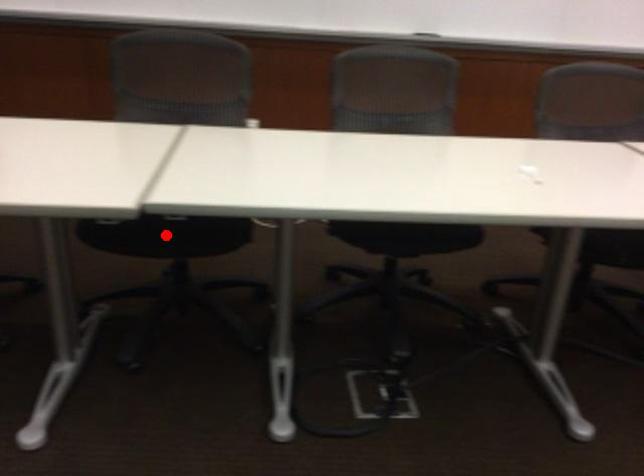
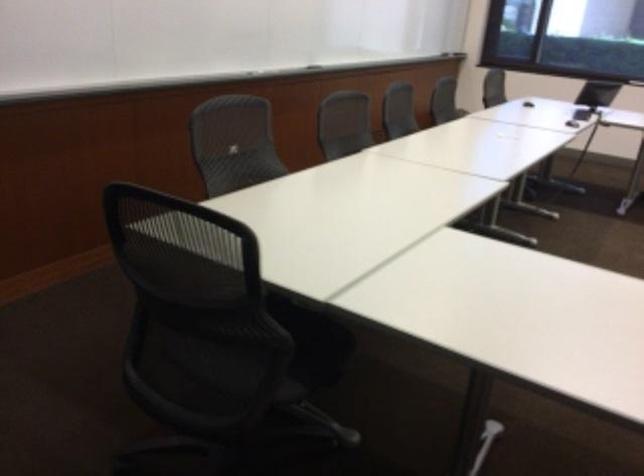
Question: I am providing you with two images of the same scene from different viewpoints. A red point is marked on the first image. Is the red point's position out of view in image 2?

Choices:
 (A) Yes
 (B) No

Answer: (A)